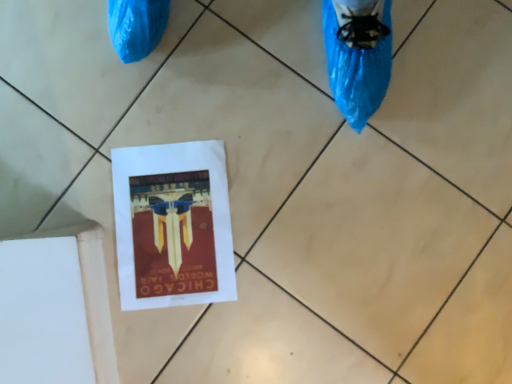
Image resolution: width=512 pixels, height=384 pixels. I want to click on vacant area on top of matte paper flyer at center (from a real-world perspective), so point(167,225).